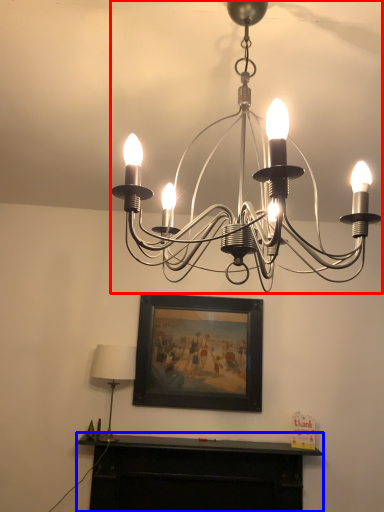
Question: Which object is closer to the camera taking this photo, lamp (highlighted by a red box) or furniture (highlighted by a blue box)?

Choices:
 (A) lamp
 (B) furniture

Answer: (A)